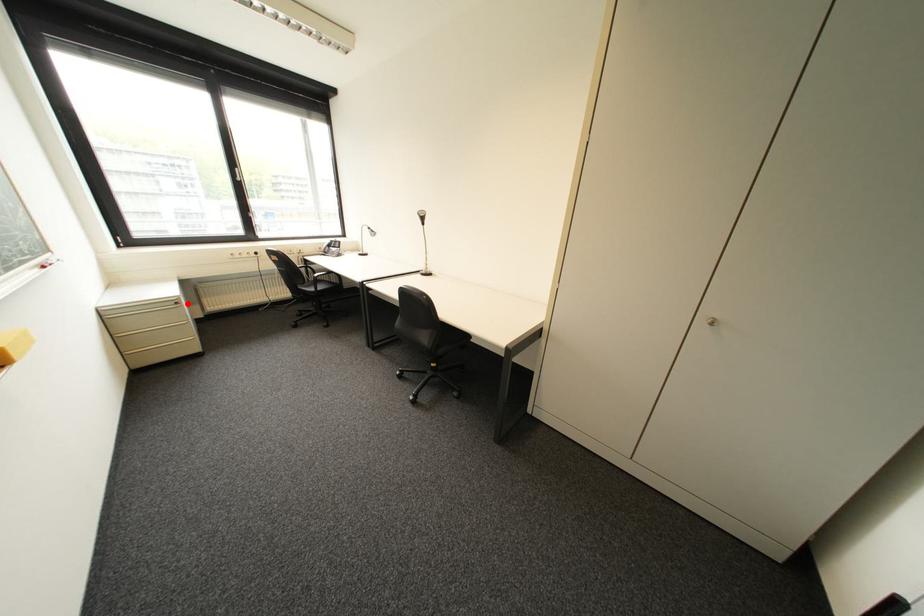
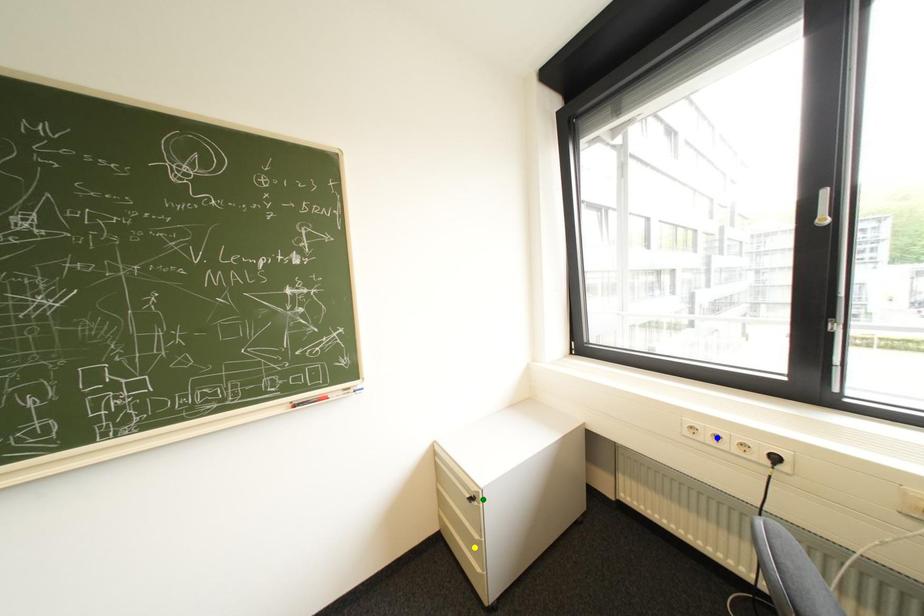
Question: I am providing you with two images of the same scene from different viewpoints. A red point is marked on the first image. You are given multiple points on the second image. Which point in image 2 is actually the same real-world point as the red point in image 1?

Choices:
 (A) blue point
 (B) green point
 (C) yellow point

Answer: (B)